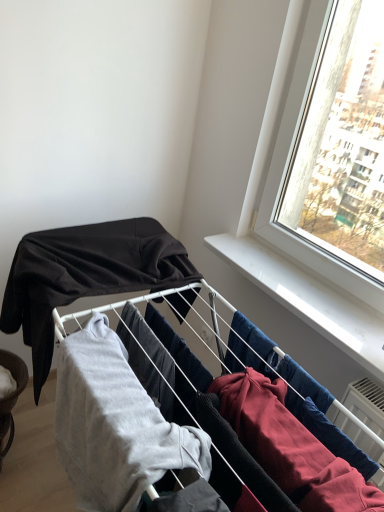
Question: From a real-world perspective, relative to matte black fabric at upper left, the 2th clothing viewed from the front, is light gray cotton sweatshirt at center, the 2th clothing viewed from the back, vertically above or below?

Choices:
 (A) above
 (B) below

Answer: (B)

Question: In the image, is light gray cotton sweatshirt at center, the 2th clothing viewed from the back, on the left side or the right side of matte black fabric at upper left, acting as the 1th clothing starting from the back?

Choices:
 (A) left
 (B) right

Answer: (B)

Question: Estimate the real-world distances between objects in this image. Which object is farther from the matte black fabric at upper left, the 2th clothing viewed from the front?

Choices:
 (A) light gray cotton sweatshirt at center, which is the 1th clothing from front to back
 (B) brushed metal bowl at lower left

Answer: (B)

Question: Which of these objects is positioned farthest from the brushed metal bowl at lower left?

Choices:
 (A) matte black fabric at upper left, acting as the 1th clothing starting from the back
 (B) light gray cotton sweatshirt at center, which is the 1th clothing from front to back

Answer: (B)